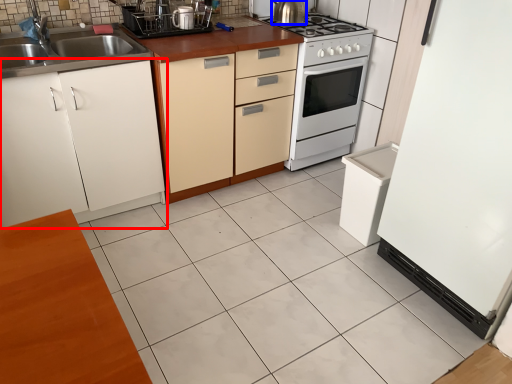
Question: Which point is closer to the camera, cabinetry (highlighted by a red box) or kitchen appliance (highlighted by a blue box)?

Choices:
 (A) cabinetry
 (B) kitchen appliance

Answer: (A)